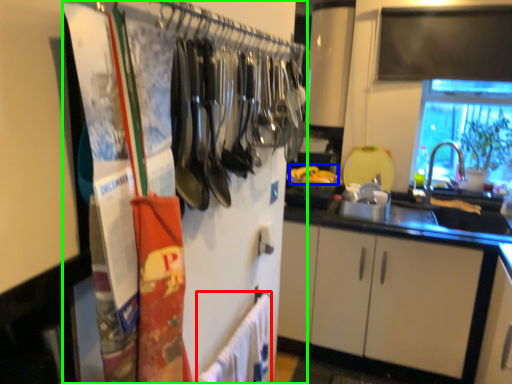
Question: Which is nearer to the bath towel (highlighted by a red box)? food (highlighted by a blue box) or closet (highlighted by a green box).

Choices:
 (A) food
 (B) closet

Answer: (B)